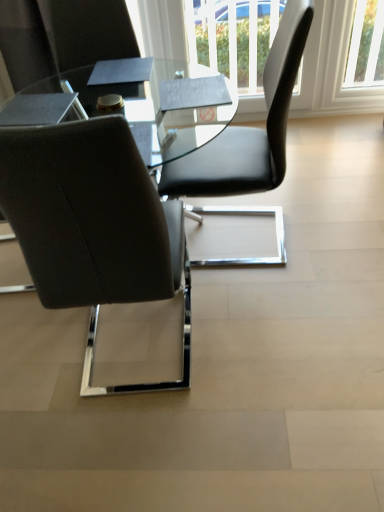
This screenshot has width=384, height=512. What do you see at coordinates (93, 225) in the screenshot? I see `matte black chair at left, the 2th chair from the right` at bounding box center [93, 225].

Locate an element on the screen. transparent glass table at center is located at coordinates (155, 106).

The width and height of the screenshot is (384, 512). In order to click on black leather chair at upper right, acting as the 2th chair starting from the left in this screenshot , I will do `click(249, 128)`.

Is transparent glass table at center spatially inside black leather chair at upper right, acting as the 2th chair starting from the left, or outside of it?

transparent glass table at center is located beyond the bounds of black leather chair at upper right, acting as the 2th chair starting from the left.

From the image's perspective, which one is positioned lower, transparent glass table at center or black leather chair at upper right, acting as the first chair starting from the right?

From the image's view, transparent glass table at center is below.

Who is shorter, transparent glass table at center or black leather chair at upper right, acting as the 2th chair starting from the left?

With less height is transparent glass table at center.

Can you confirm if matte black chair at left, the 1th chair when ordered from left to right, is shorter than white plastic window at upper right?

No.

From a real-world perspective, is matte black chair at left, the 1th chair when ordered from left to right, positioned under white plastic window at upper right based on gravity?

No, from a real-world perspective, matte black chair at left, the 1th chair when ordered from left to right, is not under white plastic window at upper right.

Does point (71, 140) come behind point (367, 66)?

No, (71, 140) is closer to viewer.

Does matte black chair at left, the 2th chair from the right, have a greater height compared to transparent glass table at center?

Indeed, matte black chair at left, the 2th chair from the right, has a greater height compared to transparent glass table at center.

Between matte black chair at left, the 1th chair when ordered from left to right, and transparent glass table at center, which one appears on the right side from the viewer's perspective?

transparent glass table at center is more to the right.

From the image's perspective, which one is positioned lower, matte black chair at left, the 2th chair from the right, or transparent glass table at center?

matte black chair at left, the 2th chair from the right, is shown below in the image.

Does point (178, 168) come in front of point (123, 241)?

No, it is not.

Is the position of black leather chair at upper right, acting as the first chair starting from the right, more distant than that of matte black chair at left, the 2th chair from the right?

Yes, black leather chair at upper right, acting as the first chair starting from the right, is further from the camera.

Is black leather chair at upper right, acting as the 2th chair starting from the left, placed right next to matte black chair at left, the 1th chair when ordered from left to right?

There is a gap between black leather chair at upper right, acting as the 2th chair starting from the left, and matte black chair at left, the 1th chair when ordered from left to right.

Is black leather chair at upper right, acting as the first chair starting from the right, aimed at matte black chair at left, the 1th chair when ordered from left to right?

No, black leather chair at upper right, acting as the first chair starting from the right, is not aimed at matte black chair at left, the 1th chair when ordered from left to right.

Image resolution: width=384 pixels, height=512 pixels. Find the location of `chair that is below the transparent glass table at center (from the image's perspective)`. chair that is below the transparent glass table at center (from the image's perspective) is located at coordinates coord(93,225).

Considering the sizes of objects transparent glass table at center and matte black chair at left, the 1th chair when ordered from left to right, in the image provided, who is smaller, transparent glass table at center or matte black chair at left, the 1th chair when ordered from left to right,?

Smaller between the two is matte black chair at left, the 1th chair when ordered from left to right.

Does transparent glass table at center touch matte black chair at left, the 2th chair from the right?

There is a gap between transparent glass table at center and matte black chair at left, the 2th chair from the right.

Which is behind, transparent glass table at center or matte black chair at left, the 1th chair when ordered from left to right?

Positioned behind is transparent glass table at center.

Which object is further away from the camera taking this photo, white plastic window at upper right or black leather chair at upper right, acting as the first chair starting from the right?

white plastic window at upper right.

Image resolution: width=384 pixels, height=512 pixels. Identify the location of window on the right of black leather chair at upper right, acting as the 2th chair starting from the left. (366, 46).

In terms of size, does white plastic window at upper right appear bigger or smaller than black leather chair at upper right, acting as the 2th chair starting from the left?

white plastic window at upper right is smaller than black leather chair at upper right, acting as the 2th chair starting from the left.

Is white plastic window at upper right next to black leather chair at upper right, acting as the 2th chair starting from the left?

white plastic window at upper right and black leather chair at upper right, acting as the 2th chair starting from the left, are not in contact.

From the picture: From the image's perspective, which one is positioned lower, white plastic window at upper right or matte black chair at left, the 1th chair when ordered from left to right?

matte black chair at left, the 1th chair when ordered from left to right.

Is white plastic window at upper right looking in the opposite direction of matte black chair at left, the 2th chair from the right?

white plastic window at upper right does not have its back to matte black chair at left, the 2th chair from the right.

Image resolution: width=384 pixels, height=512 pixels. Find the location of `the 2nd chair directly above the white plastic window at upper right (from a real-world perspective)`. the 2nd chair directly above the white plastic window at upper right (from a real-world perspective) is located at coordinates (93, 225).

In order to click on table lying on the left of black leather chair at upper right, acting as the 2th chair starting from the left in this screenshot , I will do `click(155, 106)`.

The image size is (384, 512). I want to click on window located above the matte black chair at left, the 1th chair when ordered from left to right (from the image's perspective), so click(x=366, y=46).

Looking at the image, which one is located further to transparent glass table at center, white plastic window at upper right or black leather chair at upper right, acting as the 2th chair starting from the left?

Among the two, white plastic window at upper right is located further to transparent glass table at center.

From the picture: Estimate the real-world distances between objects in this image. Which object is further from matte black chair at left, the 2th chair from the right, black leather chair at upper right, acting as the 2th chair starting from the left, or white plastic window at upper right?

white plastic window at upper right lies further to matte black chair at left, the 2th chair from the right, than the other object.

Based on their spatial positions, is matte black chair at left, the 1th chair when ordered from left to right, or black leather chair at upper right, acting as the first chair starting from the right, closer to white plastic window at upper right?

black leather chair at upper right, acting as the first chair starting from the right, is closer to white plastic window at upper right.

When comparing their distances from white plastic window at upper right, does black leather chair at upper right, acting as the 2th chair starting from the left, or transparent glass table at center seem further?

transparent glass table at center is positioned further to the anchor white plastic window at upper right.

Looking at this image, from the image, which object appears to be nearer to black leather chair at upper right, acting as the first chair starting from the right, transparent glass table at center or matte black chair at left, the 1th chair when ordered from left to right?

Based on the image, transparent glass table at center appears to be nearer to black leather chair at upper right, acting as the first chair starting from the right.

From the image, which object appears to be farther from transparent glass table at center, black leather chair at upper right, acting as the first chair starting from the right, or white plastic window at upper right?

The object further to transparent glass table at center is white plastic window at upper right.

From the image, which object appears to be farther from transparent glass table at center, matte black chair at left, the 1th chair when ordered from left to right, or black leather chair at upper right, acting as the 2th chair starting from the left?

The object further to transparent glass table at center is matte black chair at left, the 1th chair when ordered from left to right.

Which object lies further to the anchor point matte black chair at left, the 2th chair from the right, transparent glass table at center or black leather chair at upper right, acting as the first chair starting from the right?

The object further to matte black chair at left, the 2th chair from the right, is transparent glass table at center.

Where is `table between black leather chair at upper right, acting as the 2th chair starting from the left, and white plastic window at upper right, along the z-axis`? This screenshot has width=384, height=512. table between black leather chair at upper right, acting as the 2th chair starting from the left, and white plastic window at upper right, along the z-axis is located at coordinates (155, 106).

At what (x,y) coordinates should I click in order to perform the action: click on chair between matte black chair at left, the 1th chair when ordered from left to right, and transparent glass table at center in the front-back direction. Please return your answer as a coordinate pair (x, y). Looking at the image, I should click on [x=249, y=128].

What are the coordinates of `table between matte black chair at left, the 2th chair from the right, and white plastic window at upper right in the front-back direction` in the screenshot? It's located at (155, 106).

Locate an element on the screen. chair between matte black chair at left, the 2th chair from the right, and white plastic window at upper right from front to back is located at coordinates (249, 128).